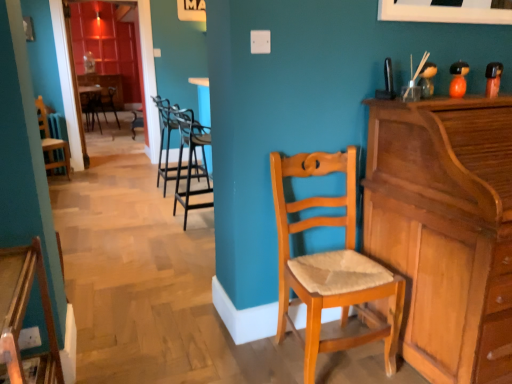
You are a GUI agent. You are given a task and a screenshot of the screen. Output one action in this format:
    pyautogui.click(x=<x>, y=<y>)
    Task: Click on the vacant space that's between black metal barstools at center, marked as the third chair in a front-to-back arrangement, and wooden chair at left, the second chair when ordered from back to front
    
    Given the screenshot: What is the action you would take?
    pyautogui.click(x=118, y=200)